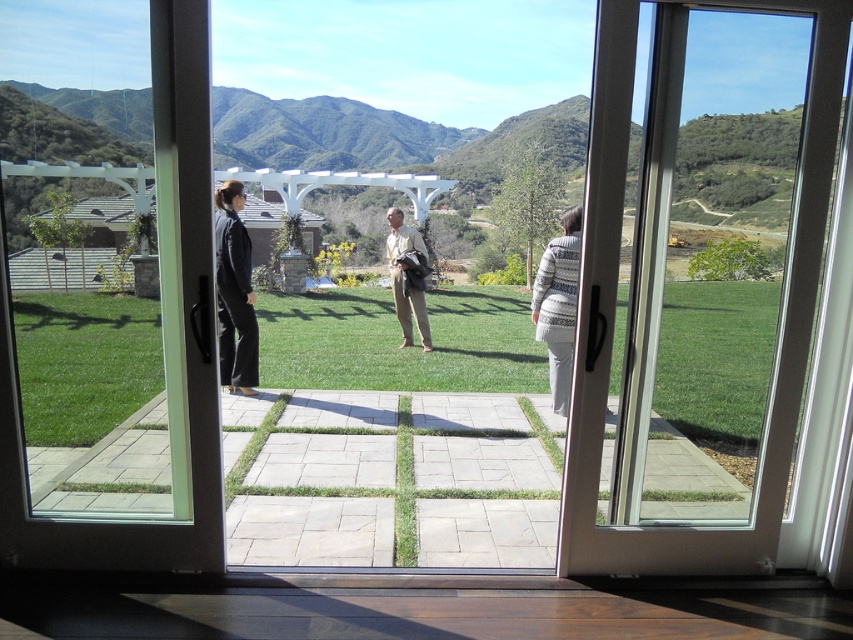
Identify the location of clear glass door at center. (106, 522).

You are a GUI agent. You are given a task and a screenshot of the screen. Output one action in this format:
    pyautogui.click(x=<x>, y=<y>)
    Task: Click on the clear glass door at center
    The width and height of the screenshot is (853, 640).
    Given the screenshot: What is the action you would take?
    pyautogui.click(x=106, y=522)

The image size is (853, 640). In order to click on clear glass door at center in this screenshot , I will do `click(106, 522)`.

Can you confirm if white glossy door at right is bigger than clear glass door at center?

Yes, white glossy door at right is bigger than clear glass door at center.

Does white glossy door at right have a greater height compared to clear glass door at center?

Indeed, white glossy door at right has a greater height compared to clear glass door at center.

At what (x,y) coordinates should I click in order to perform the action: click on white glossy door at right. Please return your answer as a coordinate pair (x, y). Looking at the image, I should click on (776, 346).

Locate an element on the screen. This screenshot has width=853, height=640. white glossy door at right is located at coordinates (776, 346).

Is black leather pants at left below gray knitted sweater at right?

Incorrect, black leather pants at left is not positioned below gray knitted sweater at right.

Between black leather pants at left and gray knitted sweater at right, which one has less height?

Standing shorter between the two is gray knitted sweater at right.

What do you see at coordinates (234, 292) in the screenshot?
I see `black leather pants at left` at bounding box center [234, 292].

Locate an element on the screen. black leather pants at left is located at coordinates (234, 292).